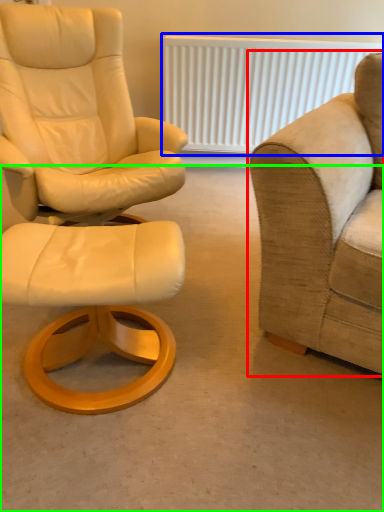
Question: Based on their relative distances, which object is farther from studio couch (highlighted by a red box)? Choose from radiator (highlighted by a blue box) and concrete (highlighted by a green box).

Choices:
 (A) radiator
 (B) concrete

Answer: (A)